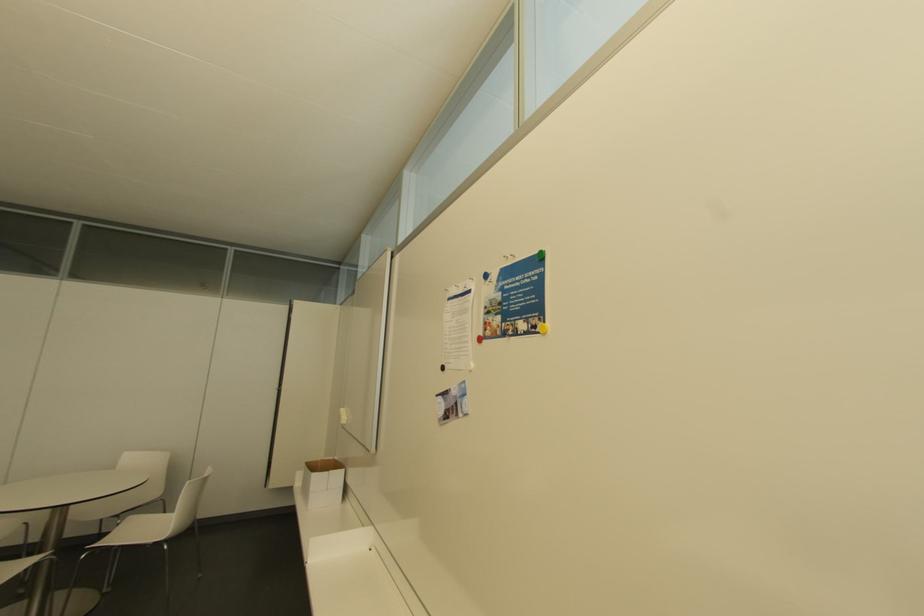
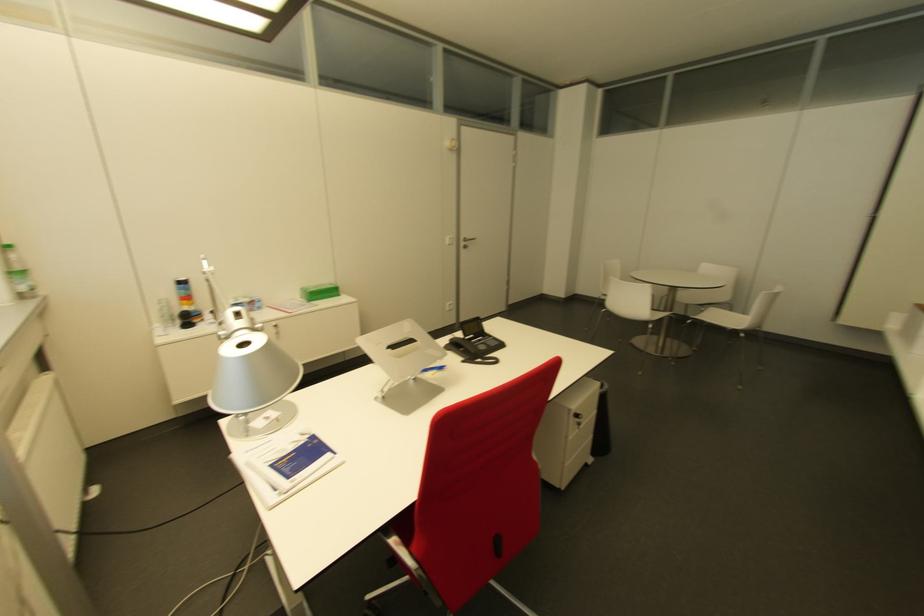
In the second image, find the point that corresponds to point (152, 493) in the first image.

(722, 298)